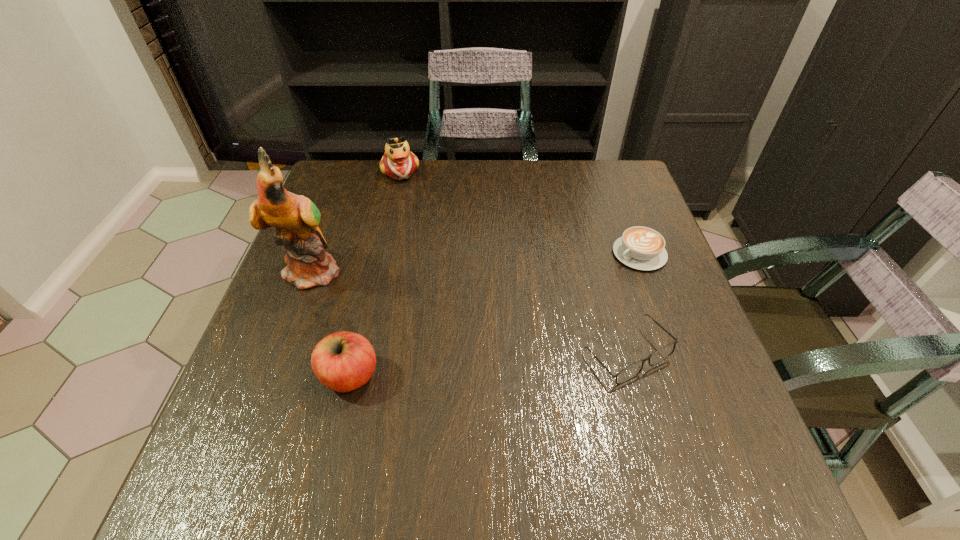
You are a GUI agent. You are given a task and a screenshot of the screen. Output one action in this format:
    pyautogui.click(x=<x>, y=<y>)
    Task: Click on the free space located 0.100m on the side of the cappuccino with the handle
    The image size is (960, 540).
    Given the screenshot: What is the action you would take?
    pyautogui.click(x=591, y=283)

Where is `blank space located 0.190m on the side of the cappuccino with the handle`? blank space located 0.190m on the side of the cappuccino with the handle is located at coordinates (563, 301).

Locate an element on the screen. free space located on the side of the cappuccino with the handle is located at coordinates (582, 289).

Where is `vacant space located on the front-facing side of the parrot`? vacant space located on the front-facing side of the parrot is located at coordinates (355, 289).

The width and height of the screenshot is (960, 540). Identify the location of vacant space situated on the front-facing side of the parrot. (363, 292).

This screenshot has height=540, width=960. Identify the location of vacant space located 0.370m on the front-facing side of the parrot. (478, 342).

You are a GUI agent. You are given a task and a screenshot of the screen. Output one action in this format:
    pyautogui.click(x=<x>, y=<y>)
    Task: Click on the object present at the far edge
    
    Given the screenshot: What is the action you would take?
    pyautogui.click(x=398, y=162)

What are the coordinates of `object present at the near edge` in the screenshot? It's located at (343, 361).

Where is `apple located in the left edge section of the desktop`? The height and width of the screenshot is (540, 960). apple located in the left edge section of the desktop is located at coordinates (343, 361).

The width and height of the screenshot is (960, 540). In order to click on duck at the left edge in this screenshot , I will do `click(398, 162)`.